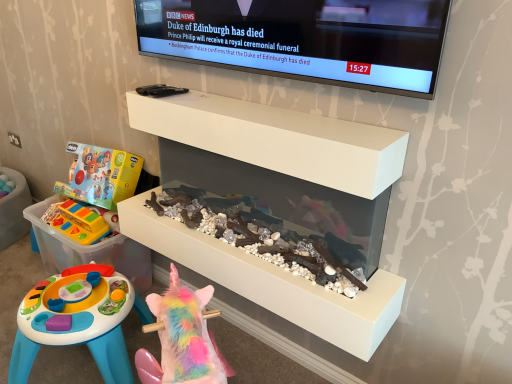
Question: From a real-world perspective, does white matte shelf at upper center sit lower than translucent plastic storage box at lower left?

Choices:
 (A) no
 (B) yes

Answer: (A)

Question: From the image's perspective, is white matte shelf at upper center above translucent plastic storage box at lower left?

Choices:
 (A) yes
 (B) no

Answer: (A)

Question: Does white matte shelf at upper center have a smaller size compared to translucent plastic storage box at lower left?

Choices:
 (A) yes
 (B) no

Answer: (A)

Question: Is translucent plastic storage box at lower left at the back of white matte shelf at upper center?

Choices:
 (A) no
 (B) yes

Answer: (A)

Question: Is white matte shelf at upper center positioned before translucent plastic storage box at lower left?

Choices:
 (A) no
 (B) yes

Answer: (B)

Question: Is white glossy aquarium at center spatially inside translucent plastic storage box at lower left, or outside of it?

Choices:
 (A) inside
 (B) outside

Answer: (B)

Question: Looking at their shapes, would you say white glossy aquarium at center is wider or thinner than translucent plastic storage box at lower left?

Choices:
 (A) thin
 (B) wide

Answer: (A)

Question: In the image, is white glossy aquarium at center positioned in front of or behind translucent plastic storage box at lower left?

Choices:
 (A) behind
 (B) front

Answer: (B)

Question: From a real-world perspective, relative to translucent plastic storage box at lower left, is white glossy aquarium at center vertically above or below?

Choices:
 (A) above
 (B) below

Answer: (A)

Question: From the image's perspective, is rainbow plush unicorn at lower center, which ranks as the second toy in left-to-right order, above or below black glossy tv at upper center?

Choices:
 (A) below
 (B) above

Answer: (A)

Question: Based on their positions, is rainbow plush unicorn at lower center, which ranks as the second toy in left-to-right order, located to the left or right of black glossy tv at upper center?

Choices:
 (A) left
 (B) right

Answer: (A)

Question: Looking at the image, does rainbow plush unicorn at lower center, which is the 2th toy in top-to-bottom order, seem bigger or smaller compared to black glossy tv at upper center?

Choices:
 (A) big
 (B) small

Answer: (A)

Question: Considering the positions of rainbow plush unicorn at lower center, which is counted as the 1th toy, starting from the bottom, and black glossy tv at upper center in the image, is rainbow plush unicorn at lower center, which is counted as the 1th toy, starting from the bottom, taller or shorter than black glossy tv at upper center?

Choices:
 (A) short
 (B) tall

Answer: (B)

Question: From the image's perspective, is black glossy tv at upper center above or below rainbow plush unicorn at lower center, which appears as the first toy when viewed from the right?

Choices:
 (A) below
 (B) above

Answer: (B)

Question: Considering the positions of black glossy tv at upper center and rainbow plush unicorn at lower center, arranged as the 2th toy when viewed from the back, in the image, is black glossy tv at upper center bigger or smaller than rainbow plush unicorn at lower center, arranged as the 2th toy when viewed from the back,?

Choices:
 (A) big
 (B) small

Answer: (B)